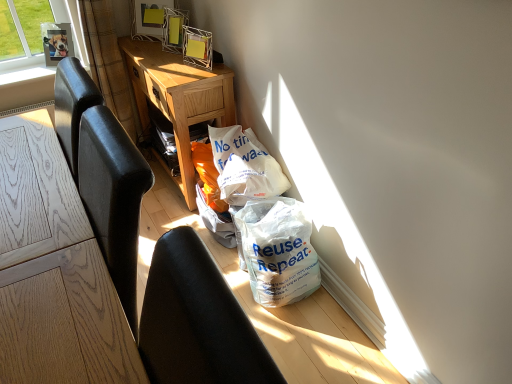
Question: Looking at the image, does metallic silver picture frame at upper center, the first picture frame from the right, seem bigger or smaller compared to brown textured curtain at upper left?

Choices:
 (A) small
 (B) big

Answer: (A)

Question: Is point (167, 6) closer or farther from the camera than point (132, 124)?

Choices:
 (A) farther
 (B) closer

Answer: (B)

Question: Considering the real-world distances, which object is farthest from the light oak desk at center?

Choices:
 (A) metallic silver picture frame at upper center, the first picture frame from the right
 (B) metallic silver picture frame at upper left, the second picture frame from the right
 (C) brown textured curtain at upper left
 (D) light wood table at left
 (E) black leather chair at lower left

Answer: (E)

Question: Which of these objects is positioned closest to the white plastic bag at center?

Choices:
 (A) black leather chair at lower left
 (B) metallic silver picture frame at upper center, the first picture frame from the right
 (C) light wood table at left
 (D) brown textured curtain at upper left
 (E) light oak desk at center

Answer: (E)